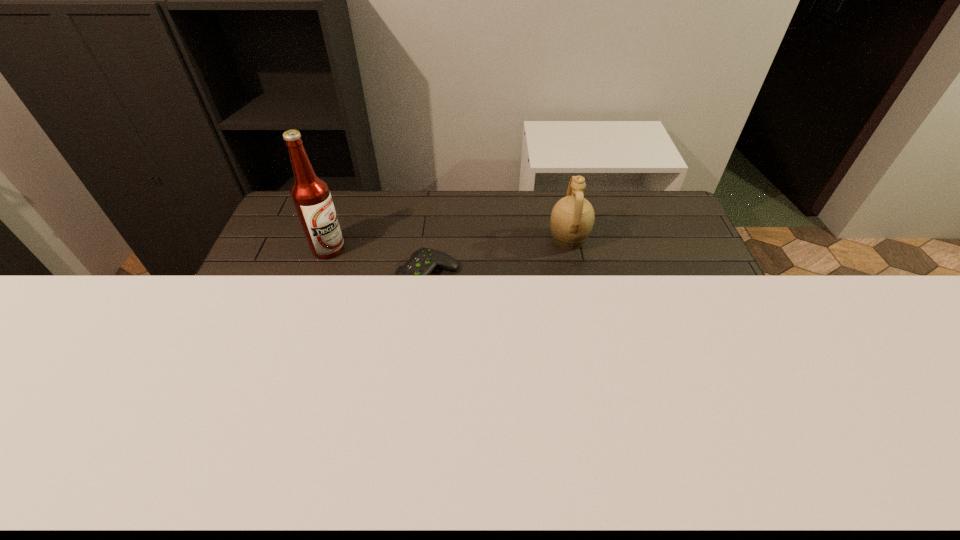
What are the coordinates of `free spot between the second shortest object and the second object from right to left` in the screenshot? It's located at (498, 259).

Identify which object is the second nearest to the control. Please provide its 2D coordinates. Your answer should be formatted as a tuple, i.e. [(x, y)], where the tuple contains the x and y coordinates of a point satisfying the conditions above.

[(572, 218)]

Find the location of `object that is the closest to the second object from left to right`. object that is the closest to the second object from left to right is located at coordinates (310, 194).

Locate an element on the screen. The width and height of the screenshot is (960, 540). free space that satisfies the following two spatial constraints: 1. on the label side of the second object from right to left; 2. on the left side of the leftmost object is located at coordinates (318, 279).

At what (x,y) coordinates should I click in order to perform the action: click on free space that satisfies the following two spatial constraints: 1. on the back side of the control; 2. on the label side of the alcohol. Please return your answer as a coordinate pair (x, y). Looking at the image, I should click on (431, 249).

Image resolution: width=960 pixels, height=540 pixels. Identify the location of vacant space that satisfies the following two spatial constraints: 1. on the label side of the tallest object; 2. on the right side of the shortest object. (318, 279).

Identify the location of free spot that satisfies the following two spatial constraints: 1. on the label side of the second object from right to left; 2. on the right side of the tallest object. (318, 279).

You are a GUI agent. You are given a task and a screenshot of the screen. Output one action in this format:
    pyautogui.click(x=<x>, y=<y>)
    Task: Click on the vacant region that satisfies the following two spatial constraints: 1. on the label side of the tallest object; 2. on the left side of the second object from left to right
    
    Given the screenshot: What is the action you would take?
    pyautogui.click(x=318, y=279)